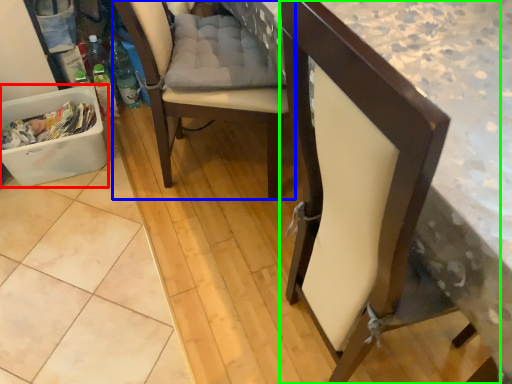
Question: Which is farther away from laundry basket (highlighted by a red box)? chair (highlighted by a blue box) or chair (highlighted by a green box)?

Choices:
 (A) chair
 (B) chair

Answer: (B)